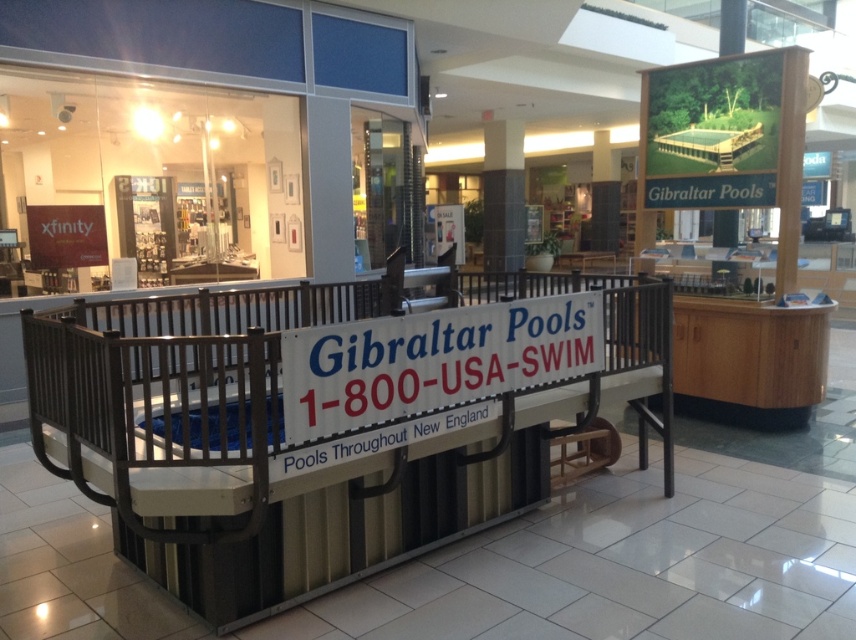
Question: Does metallic gray balustrade at center have a larger size compared to white plastic sign at center?

Choices:
 (A) yes
 (B) no

Answer: (A)

Question: Does metallic gray balustrade at center appear on the left side of white plastic sign at center?

Choices:
 (A) yes
 (B) no

Answer: (A)

Question: Does metallic gray balustrade at center appear on the left side of white plastic sign at center?

Choices:
 (A) yes
 (B) no

Answer: (A)